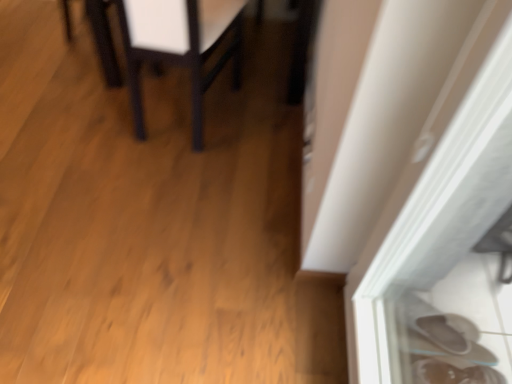
Locate an element on the screen. free space to the right of matte black table at upper left is located at coordinates (260, 135).